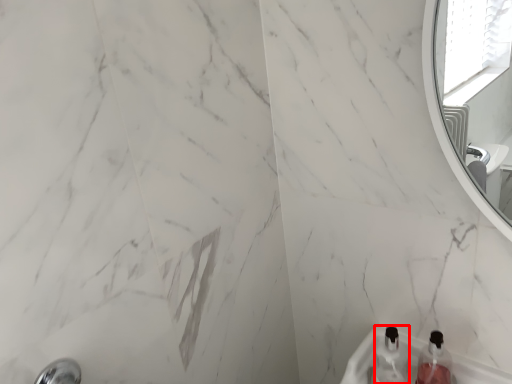
Question: Observing the image, what is the correct spatial positioning of bottle (annotated by the red box) in reference to bottle?

Choices:
 (A) right
 (B) left

Answer: (B)